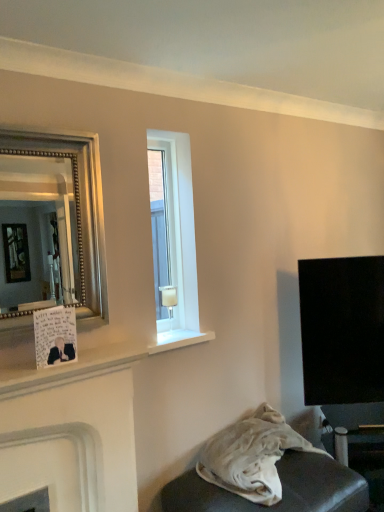
Question: Considering the relative sizes of silver beaded mirror at left and white fabric at lower right in the image provided, is silver beaded mirror at left smaller than white fabric at lower right?

Choices:
 (A) yes
 (B) no

Answer: (A)

Question: From the image's perspective, is silver beaded mirror at left below white fabric at lower right?

Choices:
 (A) yes
 (B) no

Answer: (B)

Question: Considering the relative sizes of silver beaded mirror at left and white fabric at lower right in the image provided, is silver beaded mirror at left thinner than white fabric at lower right?

Choices:
 (A) no
 (B) yes

Answer: (B)

Question: Would you consider silver beaded mirror at left to be distant from white fabric at lower right?

Choices:
 (A) no
 (B) yes

Answer: (B)

Question: Is silver beaded mirror at left positioned before white fabric at lower right?

Choices:
 (A) no
 (B) yes

Answer: (B)

Question: Considering their positions, is clear glass window at center located in front of or behind white matte fireplace at lower left?

Choices:
 (A) behind
 (B) front

Answer: (A)

Question: From the image's perspective, is clear glass window at center positioned above or below white matte fireplace at lower left?

Choices:
 (A) below
 (B) above

Answer: (B)

Question: Considering the positions of clear glass window at center and white matte fireplace at lower left in the image, is clear glass window at center wider or thinner than white matte fireplace at lower left?

Choices:
 (A) wide
 (B) thin

Answer: (B)

Question: Would you say clear glass window at center is inside or outside white matte fireplace at lower left?

Choices:
 (A) inside
 (B) outside

Answer: (B)

Question: Does point click(x=23, y=160) appear closer or farther from the camera than point click(x=249, y=480)?

Choices:
 (A) closer
 (B) farther

Answer: (B)

Question: Considering the positions of silver beaded mirror at left and white fabric at lower right in the image, is silver beaded mirror at left wider or thinner than white fabric at lower right?

Choices:
 (A) thin
 (B) wide

Answer: (A)

Question: In the image, is silver beaded mirror at left on the left side or the right side of white fabric at lower right?

Choices:
 (A) left
 (B) right

Answer: (A)

Question: From the image's perspective, is silver beaded mirror at left located above or below white fabric at lower right?

Choices:
 (A) below
 (B) above

Answer: (B)

Question: Considering the positions of white matte fireplace at lower left and silver beaded mirror at left in the image, is white matte fireplace at lower left bigger or smaller than silver beaded mirror at left?

Choices:
 (A) big
 (B) small

Answer: (A)

Question: Considering the positions of point (115, 371) and point (44, 182), is point (115, 371) closer or farther from the camera than point (44, 182)?

Choices:
 (A) farther
 (B) closer

Answer: (B)